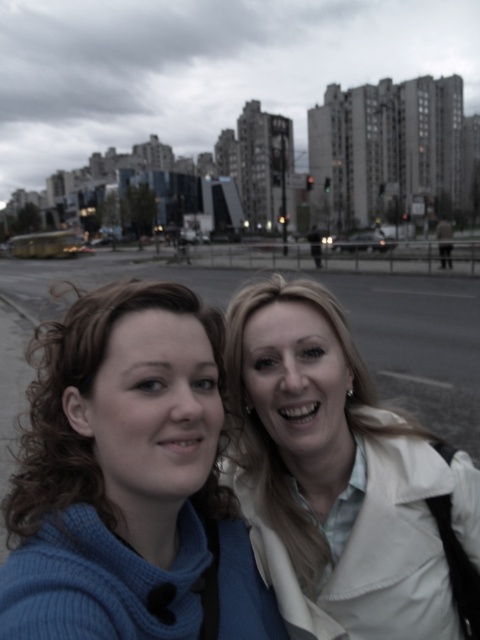
From the picture: You are a photographer trying to capture a clear shot of both the blue knitted sweater at center and the white matte jacket at center. Based on their positions, which one is closer to the camera?

The blue knitted sweater at center is below the white matte jacket at center, so the white matte jacket at center is closer to the camera.

You are a photographer trying to capture the perfect shot of the blue knitted sweater at center. Based on its position at point 0.752, 0.269, where should you aim your camera?

The blue knitted sweater at center is located at point (129, 481), so you should aim your camera slightly to the right and lower to capture it.